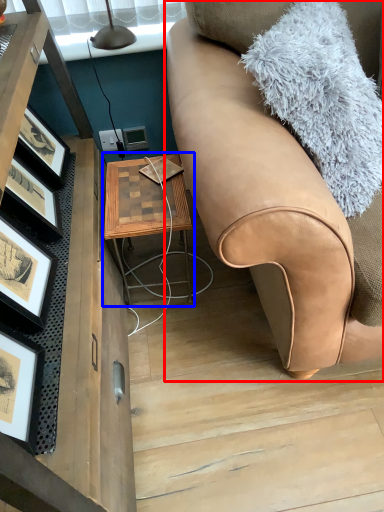
Question: Which of the following is the closest to the observer, studio couch (highlighted by a red box) or table (highlighted by a blue box)?

Choices:
 (A) studio couch
 (B) table

Answer: (A)